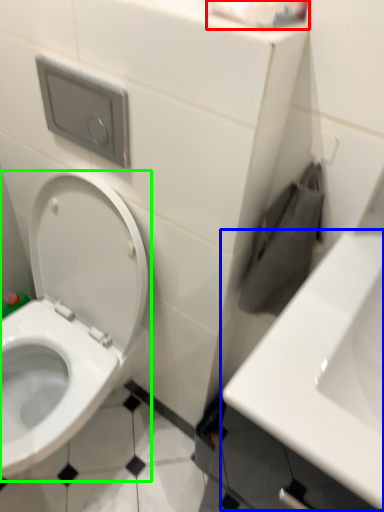
Question: Which object is the closest to the toilet paper (highlighted by a red box)? Choose among these: sink (highlighted by a blue box) or toilet (highlighted by a green box).

Choices:
 (A) sink
 (B) toilet

Answer: (A)